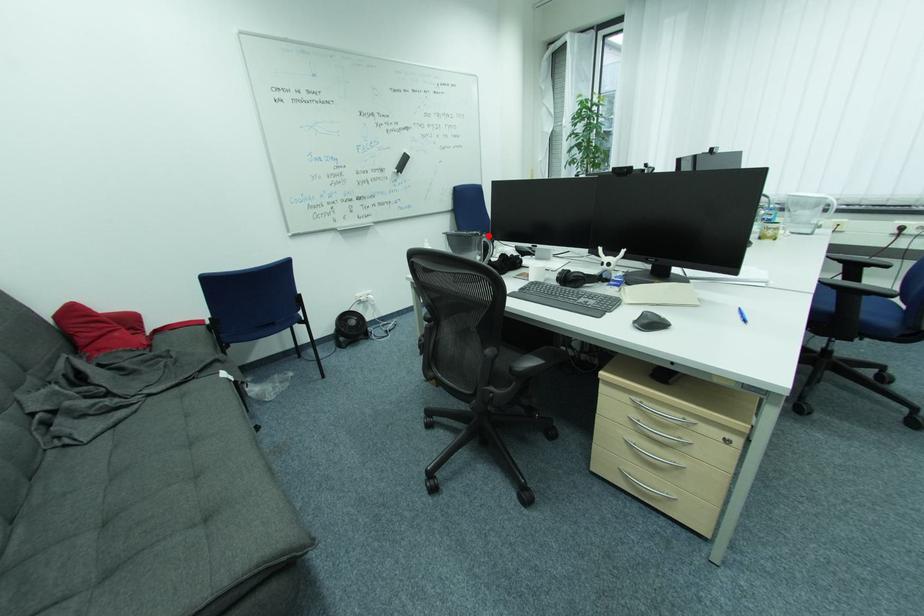
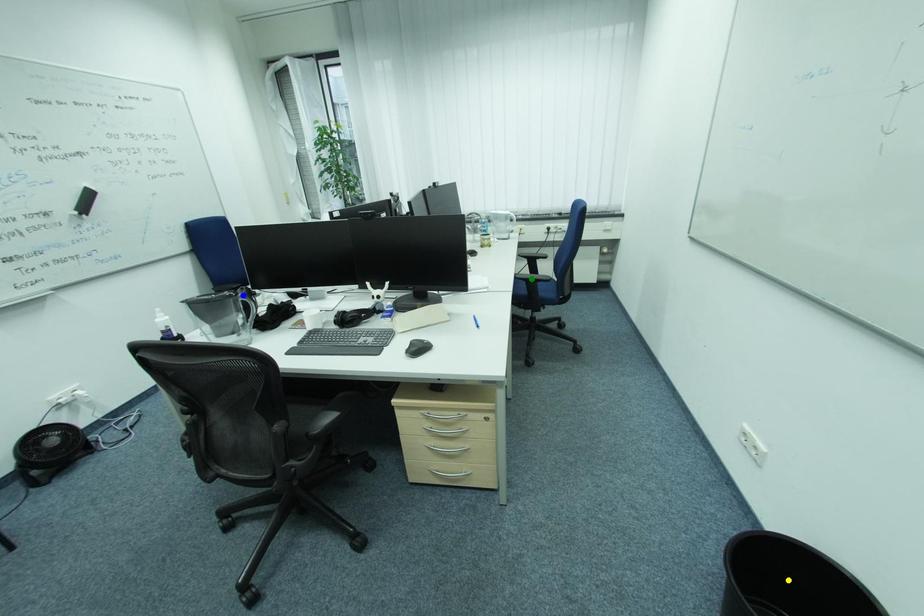
Question: I am providing you with two images of the same scene from different viewpoints. A red point is marked on the first image. You are given multiple points on the second image. In image 2, which mark is for the same physical point as the one in image 1?

Choices:
 (A) green point
 (B) yellow point
 (C) blue point

Answer: (C)